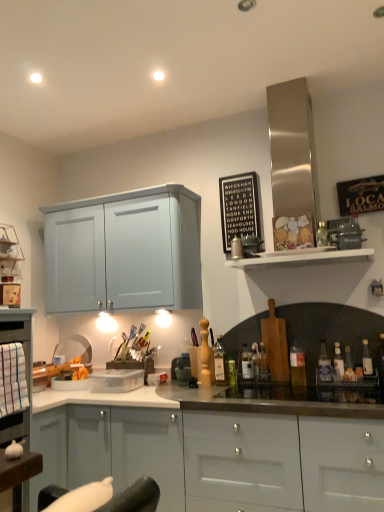
How much space does translucent glass bottle at center, arranged as the sixth bottle when viewed from the right, occupy horizontally?

2.91 inches.

You are a GUI agent. You are given a task and a screenshot of the screen. Output one action in this format:
    pyautogui.click(x=<x>, y=<y>)
    Task: Click on the metallic silver toaster at upper center, the 2th appliance from the back
    This screenshot has width=384, height=512.
    Given the screenshot: What is the action you would take?
    pyautogui.click(x=251, y=245)

The width and height of the screenshot is (384, 512). Describe the element at coordinates (251, 245) in the screenshot. I see `metallic silver toaster at upper center, which appears as the second appliance when viewed from the right` at that location.

Image resolution: width=384 pixels, height=512 pixels. Find the location of `matte gray cabinets at center`. matte gray cabinets at center is located at coordinates (217, 457).

Image resolution: width=384 pixels, height=512 pixels. Identify the location of translucent glass bottle at right, positioned as the 3th bottle in left-to-right order. (247, 362).

The height and width of the screenshot is (512, 384). Describe the element at coordinates (247, 362) in the screenshot. I see `translucent glass bottle at right, positioned as the 3th bottle in left-to-right order` at that location.

Measure the distance between point (222, 383) and camera.

The distance of point (222, 383) from camera is 8.82 feet.

Describe the element at coordinates (297, 365) in the screenshot. I see `translucent glass bottle at right, which is counted as the fifth bottle, starting from the right` at that location.

Measure the distance between translucent glass bottle at right, which is counted as the fifth bottle, starting from the right, and camera.

translucent glass bottle at right, which is counted as the fifth bottle, starting from the right, and camera are 8.32 feet apart from each other.

Describe the element at coordinates (255, 359) in the screenshot. This screenshot has width=384, height=512. I see `translucent glass bottle at center, acting as the 7th bottle starting from the right` at that location.

You are a GUI agent. You are given a task and a screenshot of the screen. Output one action in this format:
    pyautogui.click(x=<x>, y=<y>)
    Task: Click on the translucent glass bottle at center, marked as the 4th bottle in a left-to-right arrangement
    
    Given the screenshot: What is the action you would take?
    pyautogui.click(x=255, y=359)

Identify the location of translucent glass bottle at center, arranged as the sixth bottle when viewed from the right. (263, 362).

Can we say green glass bottle at center, acting as the second bottle starting from the left, lies outside translucent glass bottle at right, which is counted as the fifth bottle, starting from the right?

Yes, green glass bottle at center, acting as the second bottle starting from the left, is not within translucent glass bottle at right, which is counted as the fifth bottle, starting from the right.

From a real-world perspective, between green glass bottle at center, which is the 9th bottle in right-to-left order, and translucent glass bottle at right, which is counted as the fifth bottle, starting from the right, who is vertically lower?

green glass bottle at center, which is the 9th bottle in right-to-left order.

Is green glass bottle at center, which is the 9th bottle in right-to-left order, further to camera compared to translucent glass bottle at right, which is counted as the fifth bottle, starting from the right?

Yes, the depth of green glass bottle at center, which is the 9th bottle in right-to-left order, is greater than that of translucent glass bottle at right, which is counted as the fifth bottle, starting from the right.

Could you tell me if green glass bottle at center, which is the 9th bottle in right-to-left order, is turned towards translucent glass bottle at right, positioned as the sixth bottle in left-to-right order?

No, green glass bottle at center, which is the 9th bottle in right-to-left order, is not aimed at translucent glass bottle at right, positioned as the sixth bottle in left-to-right order.

From the image's perspective, which one is positioned lower, clear plastic container at center, placed as the 3th appliance when sorted from front to back, or translucent glass bottle at right, which is the second bottle in right-to-left order?

clear plastic container at center, placed as the 3th appliance when sorted from front to back, appears lower in the image.

Consider the image. Is clear plastic container at center, which is counted as the 1th appliance, starting from the bottom, facing away from translucent glass bottle at right, the 9th bottle positioned from the left?

No, translucent glass bottle at right, the 9th bottle positioned from the left, is not at the back of clear plastic container at center, which is counted as the 1th appliance, starting from the bottom.

From a real-world perspective, which object stands above the other?

From a 3D spatial view, translucent glass bottle at right, the 9th bottle positioned from the left, is above.

Considering the sizes of clear plastic container at center, placed as the 1th appliance when sorted from back to front, and translucent glass bottle at right, which is the second bottle in right-to-left order, in the image, is clear plastic container at center, placed as the 1th appliance when sorted from back to front, bigger or smaller than translucent glass bottle at right, which is the second bottle in right-to-left order,?

clear plastic container at center, placed as the 1th appliance when sorted from back to front, is bigger than translucent glass bottle at right, which is the second bottle in right-to-left order.

Is translucent glass bottle at right, positioned as the sixth bottle in left-to-right order, facing towards translucent glass bottle at center, acting as the 7th bottle starting from the right?

No, translucent glass bottle at right, positioned as the sixth bottle in left-to-right order, is not facing towards translucent glass bottle at center, acting as the 7th bottle starting from the right.

From a real-world perspective, between translucent glass bottle at right, positioned as the sixth bottle in left-to-right order, and translucent glass bottle at center, acting as the 7th bottle starting from the right, who is vertically higher?

translucent glass bottle at right, positioned as the sixth bottle in left-to-right order.

Considering the relative sizes of translucent glass bottle at right, positioned as the sixth bottle in left-to-right order, and translucent glass bottle at center, acting as the 7th bottle starting from the right, in the image provided, is translucent glass bottle at right, positioned as the sixth bottle in left-to-right order, wider than translucent glass bottle at center, acting as the 7th bottle starting from the right,?

Correct, the width of translucent glass bottle at right, positioned as the sixth bottle in left-to-right order, exceeds that of translucent glass bottle at center, acting as the 7th bottle starting from the right.

Is clear glass bottle at right, the first bottle in the right-to-left sequence, shorter than black wood sign at upper center?

Yes.

From the image's perspective, is clear glass bottle at right, the first bottle in the right-to-left sequence, located above or below black wood sign at upper center?

clear glass bottle at right, the first bottle in the right-to-left sequence, is below black wood sign at upper center.

Can you confirm if clear glass bottle at right, the first bottle in the right-to-left sequence, is wider than black wood sign at upper center?

Yes.

In the scene shown: Is clear glass bottle at right, the first bottle in the right-to-left sequence, outside of black wood sign at upper center?

Indeed, clear glass bottle at right, the first bottle in the right-to-left sequence, is completely outside black wood sign at upper center.

Considering the positions of objects clear plastic container at center, which appears as the first appliance when viewed from the left, and metallic silver appliance at upper right, the first appliance positioned from the front, in the image provided, who is more to the left, clear plastic container at center, which appears as the first appliance when viewed from the left, or metallic silver appliance at upper right, the first appliance positioned from the front,?

Positioned to the left is clear plastic container at center, which appears as the first appliance when viewed from the left.

What's the angular difference between clear plastic container at center, placed as the 1th appliance when sorted from back to front, and metallic silver appliance at upper right, the first appliance positioned from the front,'s facing directions?

clear plastic container at center, placed as the 1th appliance when sorted from back to front, and metallic silver appliance at upper right, the first appliance positioned from the front, are facing 0.00196 degrees away from each other.

Consider the image. Is metallic silver appliance at upper right, the 1th appliance from the right, inside clear plastic container at center, placed as the 3th appliance when sorted from front to back?

No, metallic silver appliance at upper right, the 1th appliance from the right, is not a part of clear plastic container at center, placed as the 3th appliance when sorted from front to back.

From the image's perspective, does clear plastic container at center, the third appliance in the top-to-bottom sequence, appear lower than metallic silver appliance at upper right, the 3th appliance in the back-to-front sequence?

Yes.

Is translucent glass bottle at right, the 8th bottle viewed from the right, smaller than metallic silver appliance at upper right, which ranks as the 3th appliance in bottom-to-top order?

Indeed, translucent glass bottle at right, the 8th bottle viewed from the right, has a smaller size compared to metallic silver appliance at upper right, which ranks as the 3th appliance in bottom-to-top order.

Considering the positions of points (248, 376) and (351, 217), is point (248, 376) farther from camera compared to point (351, 217)?

Yes, it is.

Based on the photo, is translucent glass bottle at right, the 8th bottle viewed from the right, at the left side of metallic silver appliance at upper right, the 3th appliance positioned from the left?

Indeed, translucent glass bottle at right, the 8th bottle viewed from the right, is positioned on the left side of metallic silver appliance at upper right, the 3th appliance positioned from the left.

From the image's perspective, relative to green glass bottle at center, acting as the second bottle starting from the left, is white wooden shelf at upper right above or below?

Clearly, from the image's perspective, white wooden shelf at upper right is above green glass bottle at center, acting as the second bottle starting from the left.

Is white wooden shelf at upper right facing away from green glass bottle at center, which is the 9th bottle in right-to-left order?

No, white wooden shelf at upper right is not facing away from green glass bottle at center, which is the 9th bottle in right-to-left order.

Is point (304, 254) positioned after point (228, 360)?

That is False.

How different are the orientations of white wooden shelf at upper right and green glass bottle at center, acting as the second bottle starting from the left, in degrees?

0.0029 degrees.

Locate an element on the screen. Image resolution: width=384 pixels, height=512 pixels. the 7th bottle above the green glass bottle at center, which is the 9th bottle in right-to-left order (from the image's perspective) is located at coordinates (297, 365).

At what (x,y) coordinates should I click in order to perform the action: click on appliance that is the 2nd object located behind the translucent glass bottle at right, which is the second bottle in right-to-left order. Please return your answer as a coordinate pair (x, y). The width and height of the screenshot is (384, 512). Looking at the image, I should click on (116, 380).

Considering their positions, is translucent glass bottle at center, arranged as the sixth bottle when viewed from the right, positioned further to clear plastic container at center, the 3th appliance positioned from the right, than matte gray cabinets at center?

Among the two, translucent glass bottle at center, arranged as the sixth bottle when viewed from the right, is located further to clear plastic container at center, the 3th appliance positioned from the right.

Estimate the real-world distances between objects in this image. Which object is closer to metallic silver appliance at upper right, the 1th appliance from the right, translucent glass bottle at right, the 8th bottle viewed from the right, or green glass bottle at center, which is the 9th bottle in right-to-left order?

Based on the image, translucent glass bottle at right, the 8th bottle viewed from the right, appears to be nearer to metallic silver appliance at upper right, the 1th appliance from the right.

Considering their positions, is green glass bottle at center, which is the 9th bottle in right-to-left order, positioned closer to clear glass bottle at right, acting as the 10th bottle starting from the left, than translucent glass bottle at right, positioned as the 3th bottle in left-to-right order?

Among the two, translucent glass bottle at right, positioned as the 3th bottle in left-to-right order, is located nearer to clear glass bottle at right, acting as the 10th bottle starting from the left.

From the image, which object appears to be farther from green glass bottle at center, which is the 9th bottle in right-to-left order, translucent glass bottle at center, marked as the 4th bottle in a left-to-right arrangement, or translucent glass bottle at center, the 10th bottle from the right?

translucent glass bottle at center, marked as the 4th bottle in a left-to-right arrangement.

Which object lies further to the anchor point metallic silver toaster at upper center, the 2th appliance from the back, metallic silver appliance at upper right, the 3th appliance positioned from the left, or translucent glass bottle at right, positioned as the 3th bottle in left-to-right order?

translucent glass bottle at right, positioned as the 3th bottle in left-to-right order, is positioned further to the anchor metallic silver toaster at upper center, the 2th appliance from the back.

Based on their spatial positions, is clear glass bottle at right, the seventh bottle positioned from the left, or black wood sign at upper center further from metallic silver appliance at upper right, the 3th appliance positioned from the left?

The object further to metallic silver appliance at upper right, the 3th appliance positioned from the left, is clear glass bottle at right, the seventh bottle positioned from the left.

Considering their positions, is black wood sign at upper center positioned further to translucent glass bottle at right, positioned as the sixth bottle in left-to-right order, than metallic silver toaster at upper center, which appears as the 2th appliance when viewed from the left?

black wood sign at upper center is further to translucent glass bottle at right, positioned as the sixth bottle in left-to-right order.

Estimate the real-world distances between objects in this image. Which object is closer to metallic silver appliance at upper right, the 1th appliance from the right, black wood sign at upper center or matte gray cabinets at center?

Among the two, black wood sign at upper center is located nearer to metallic silver appliance at upper right, the 1th appliance from the right.

The image size is (384, 512). Identify the location of bottle that lies between black wood sign at upper center and clear glass bottle at right, acting as the 10th bottle starting from the left, from top to bottom. (324, 365).

Where is `shelf located between clear plastic container at center, placed as the 3th appliance when sorted from front to back, and clear glass bottle at right, which is counted as the 4th bottle, starting from the right, in the left-right direction`? The image size is (384, 512). shelf located between clear plastic container at center, placed as the 3th appliance when sorted from front to back, and clear glass bottle at right, which is counted as the 4th bottle, starting from the right, in the left-right direction is located at coordinates (301, 258).

Where is `appliance situated between clear plastic container at center, placed as the 3th appliance when sorted from front to back, and translucent glass bottle at center, acting as the 7th bottle starting from the right, from left to right`? This screenshot has height=512, width=384. appliance situated between clear plastic container at center, placed as the 3th appliance when sorted from front to back, and translucent glass bottle at center, acting as the 7th bottle starting from the right, from left to right is located at coordinates (251, 245).

At what (x,y) coordinates should I click in order to perform the action: click on shelf between black wood sign at upper center and clear glass bottle at right, the first bottle in the right-to-left sequence, vertically. Please return your answer as a coordinate pair (x, y). Looking at the image, I should click on (301, 258).